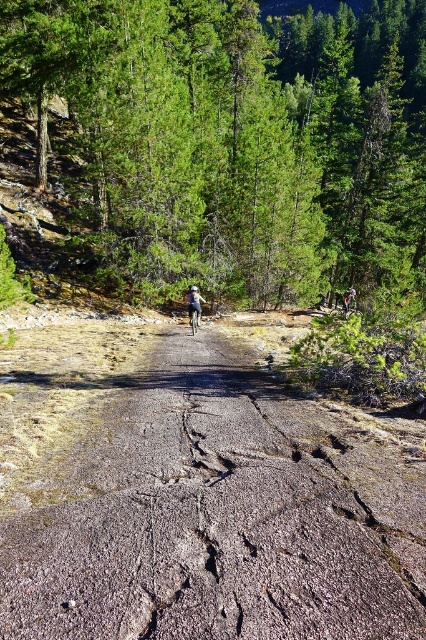
Does green leafy tree at center have a smaller size compared to brown cracked dirt at center?

Actually, green leafy tree at center might be larger than brown cracked dirt at center.

Does green leafy tree at center have a lesser width compared to brown cracked dirt at center?

No.

Is point (368, 80) behind point (423, 428)?

Yes, point (368, 80) is behind point (423, 428).

The width and height of the screenshot is (426, 640). In order to click on green leafy tree at center in this screenshot , I will do `click(235, 138)`.

Which is in front, point (403, 557) or point (189, 316)?

Point (403, 557)

Find the location of `brown cracked dirt at center`. brown cracked dirt at center is located at coordinates (226, 516).

Is point (143, 461) in front of point (195, 321)?

That is True.

Image resolution: width=426 pixels, height=640 pixels. Identify the location of brown cracked dirt at center. (226, 516).

Can you confirm if green leafy tree at center is positioned above silver metallic mountain bike at center?

Indeed, green leafy tree at center is positioned over silver metallic mountain bike at center.

Between point (166, 276) and point (198, 310), which one is positioned behind?

Positioned behind is point (166, 276).

The width and height of the screenshot is (426, 640). Describe the element at coordinates (235, 138) in the screenshot. I see `green leafy tree at center` at that location.

The height and width of the screenshot is (640, 426). In order to click on green leafy tree at center in this screenshot , I will do `click(235, 138)`.